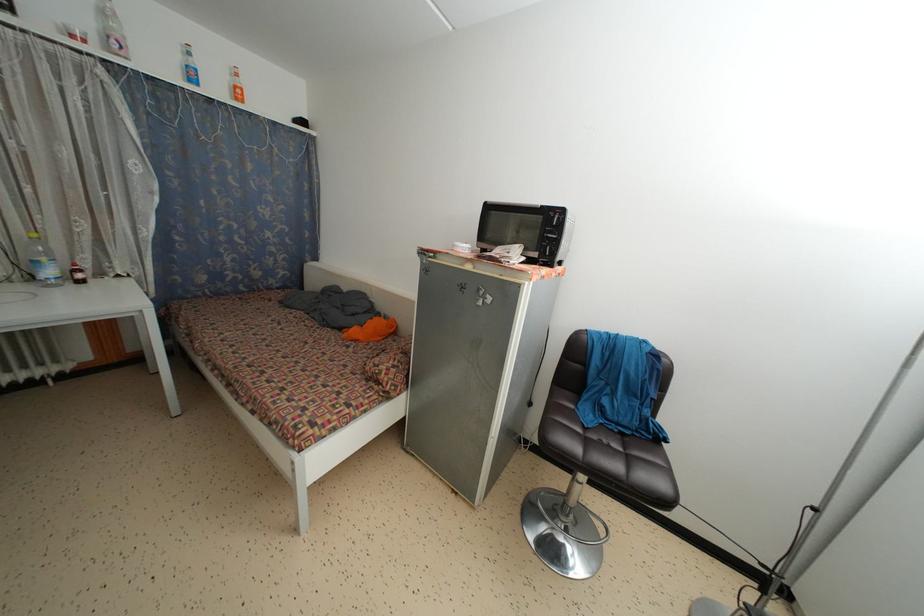
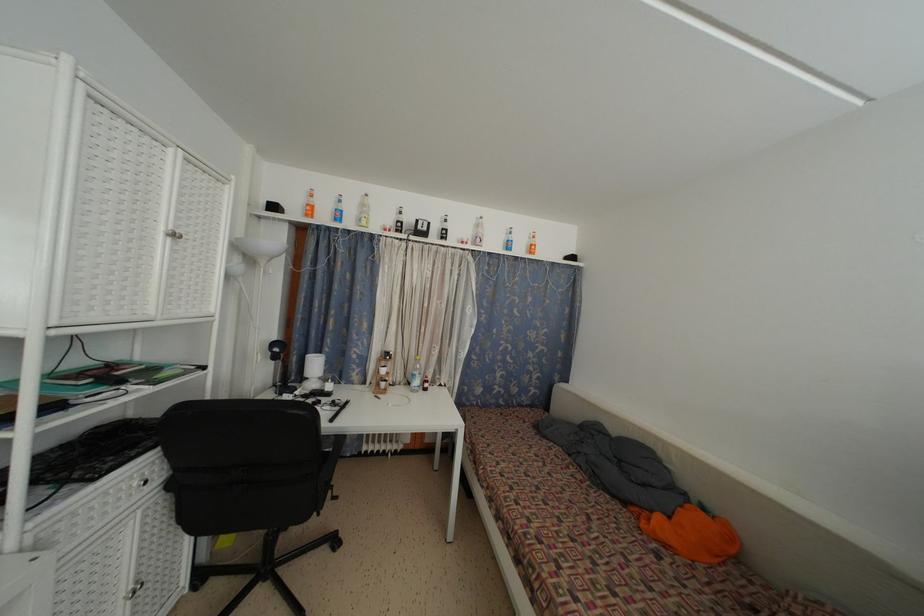
The first image is from the beginning of the video and the second image is from the end. How did the camera likely rotate when shooting the video?

The camera's rotation is toward left-up.